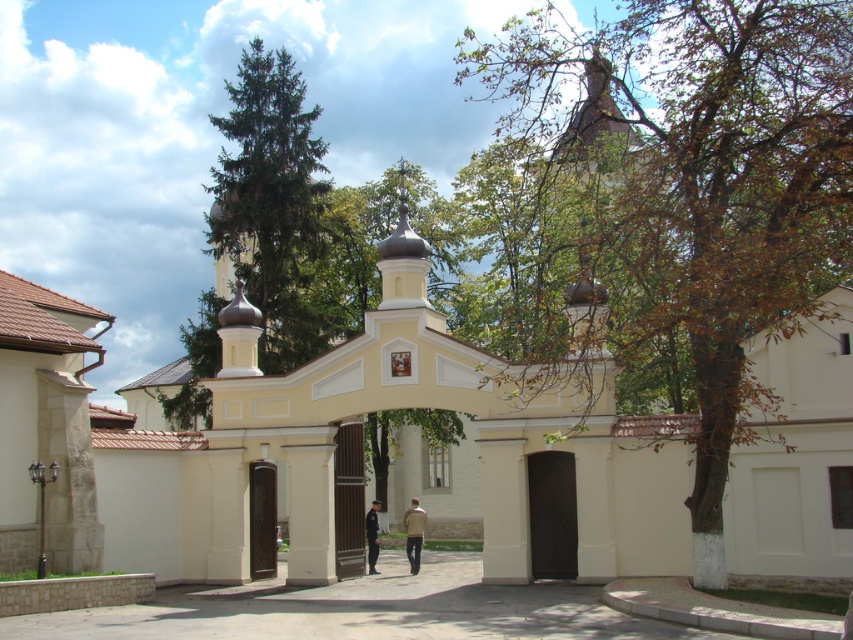
You are a visitor at the religious site and see the beige fabric jacket at center and the uniformed officer at center. Which one is covering part of the other?

The beige fabric jacket at center is positioned over the uniformed officer at center, so it is covering part of them.

You are a visitor at the religious site and want to know which person is more likely to be a staff member. Based on the beige fabric jacket at center and the uniformed officer at center, which one has a slimmer build?

The beige fabric jacket at center is thinner than the uniformed officer at center, so the person wearing the beige fabric jacket at center has a slimmer build.